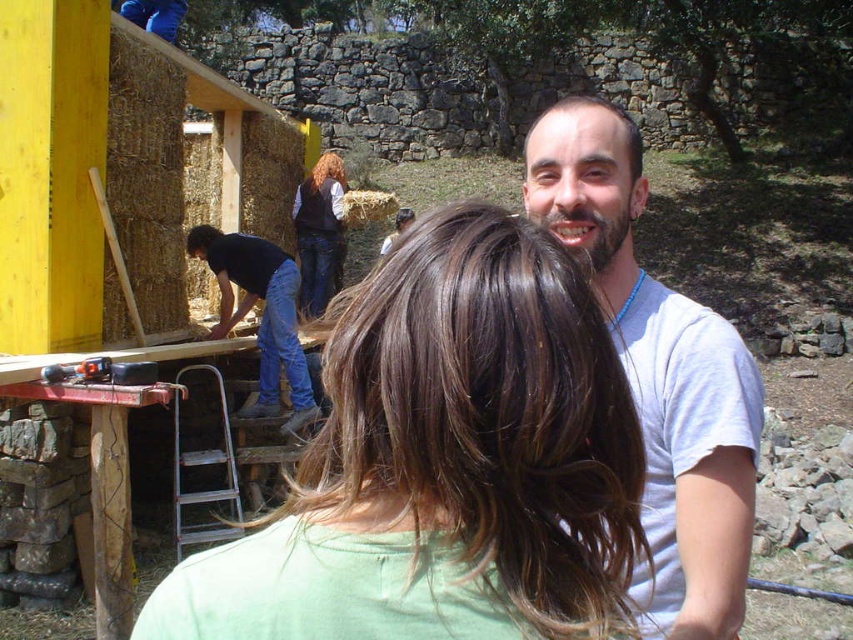
Who is taller, blue jeans at left or denim jeans at center?

With more height is denim jeans at center.

Is blue jeans at left to the left of denim jeans at center from the viewer's perspective?

Correct, you'll find blue jeans at left to the left of denim jeans at center.

At what (x,y) coordinates should I click in order to perform the action: click on blue jeans at left. Please return your answer as a coordinate pair (x, y). Looking at the image, I should click on (260, 314).

Locate an element on the screen. This screenshot has width=853, height=640. blue jeans at left is located at coordinates (260, 314).

Which is more to the right, blue jeans at left or black plastic drill at lower left?

black plastic drill at lower left is more to the right.

Can you confirm if blue jeans at left is wider than black plastic drill at lower left?

Yes.

Looking at this image, who is more forward, (271, 317) or (106, 360)?

Point (106, 360)

Identify the location of blue jeans at left. The image size is (853, 640). (260, 314).

Which is behind, point (660, 358) or point (305, 264)?

The point (305, 264) is behind.

Measure the distance between point (630, 349) and camera.

They are 1.44 meters apart.

Locate an element on the screen. The image size is (853, 640). white matte t-shirt at center is located at coordinates (659, 374).